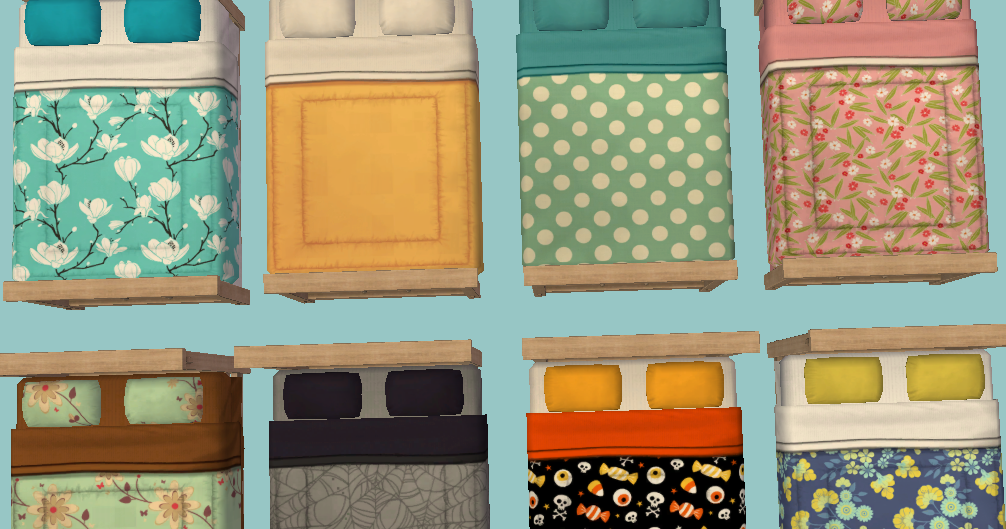
What are the coordinates of `spiderweb comforter` in the screenshot? It's located at (367, 500).